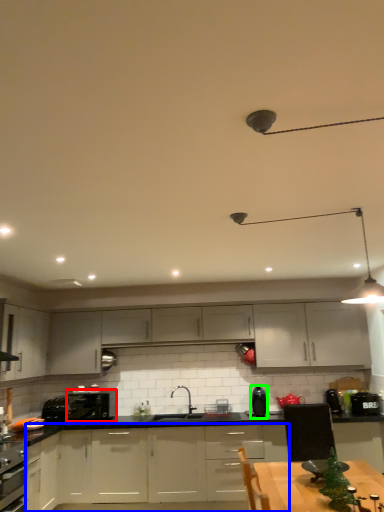
Question: Considering the real-world distances, which object is closest to kitchen appliance (highlighted by a red box)? cabinetry (highlighted by a blue box) or kitchen appliance (highlighted by a green box).

Choices:
 (A) cabinetry
 (B) kitchen appliance

Answer: (A)